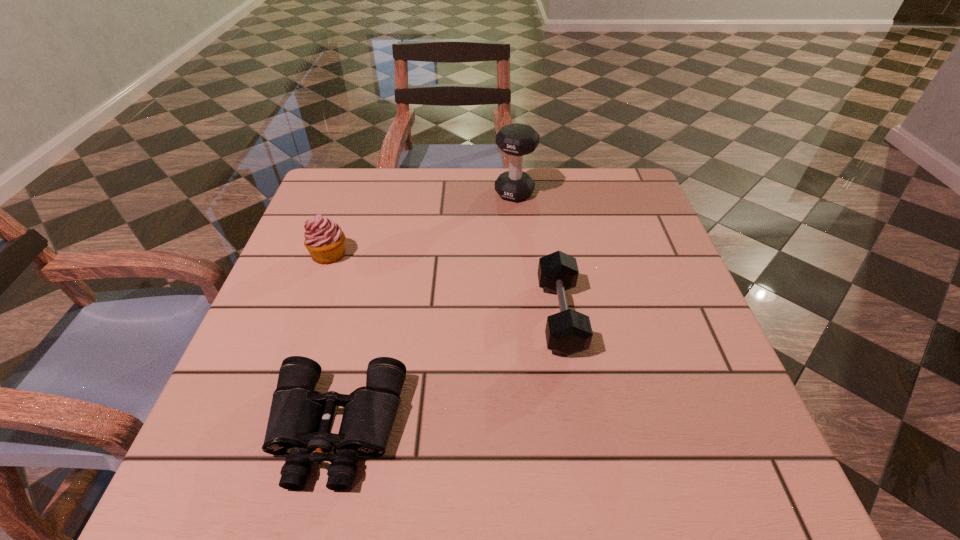
Locate an element on the screen. Image resolution: width=960 pixels, height=540 pixels. blank area located 0.100m on the right of the nearer dumbbell is located at coordinates (630, 315).

This screenshot has height=540, width=960. In order to click on object located at the far edge in this screenshot , I will do `click(516, 140)`.

Where is `object positioned at the near edge`? The height and width of the screenshot is (540, 960). object positioned at the near edge is located at coordinates coord(300,418).

Where is `cupcake located in the left edge section of the desktop`? cupcake located in the left edge section of the desktop is located at coordinates (324, 239).

Where is `binoculars at the left edge`? binoculars at the left edge is located at coordinates coord(300,418).

The width and height of the screenshot is (960, 540). Identify the location of object that is positioned at the near left corner. (300, 418).

In the image, there is a desktop. At what (x,y) coordinates should I click in order to perform the action: click on vacant space at the far edge. Please return your answer as a coordinate pair (x, y). The width and height of the screenshot is (960, 540). Looking at the image, I should click on click(386, 205).

The width and height of the screenshot is (960, 540). In the image, there is a desktop. In order to click on vacant area at the near edge in this screenshot , I will do [561, 467].

Locate an element on the screen. Image resolution: width=960 pixels, height=540 pixels. vacant point at the left edge is located at coordinates (287, 261).

What are the coordinates of `vacant area at the right edge of the desktop` in the screenshot? It's located at (687, 364).